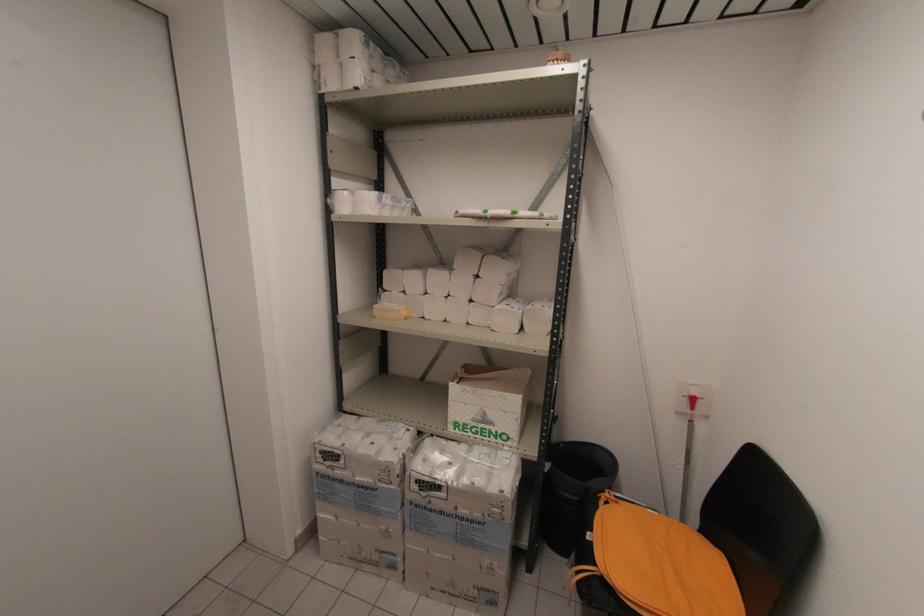
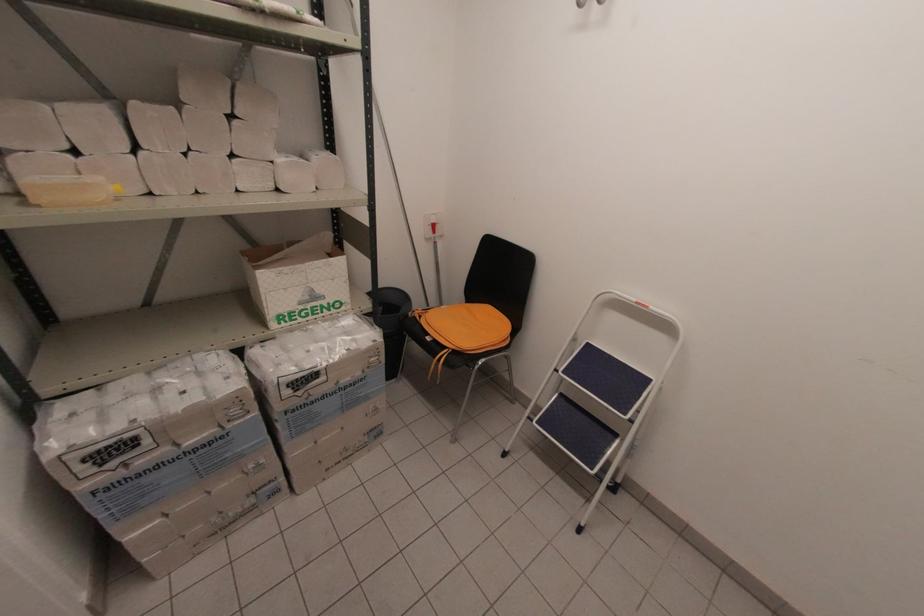
Where in the second image is the point corresponding to the point at 322,453 from the first image?

(84, 463)